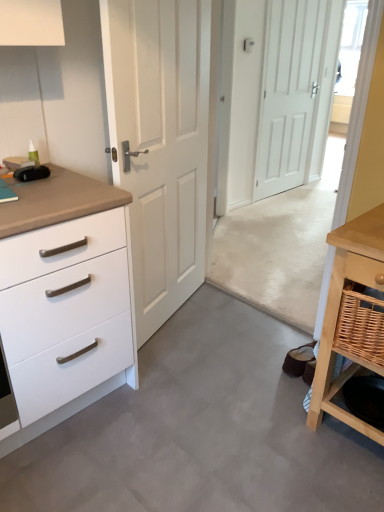
In order to click on free space to the right of white matte door at center, the 2th door when ordered from back to front in this screenshot , I will do `click(233, 320)`.